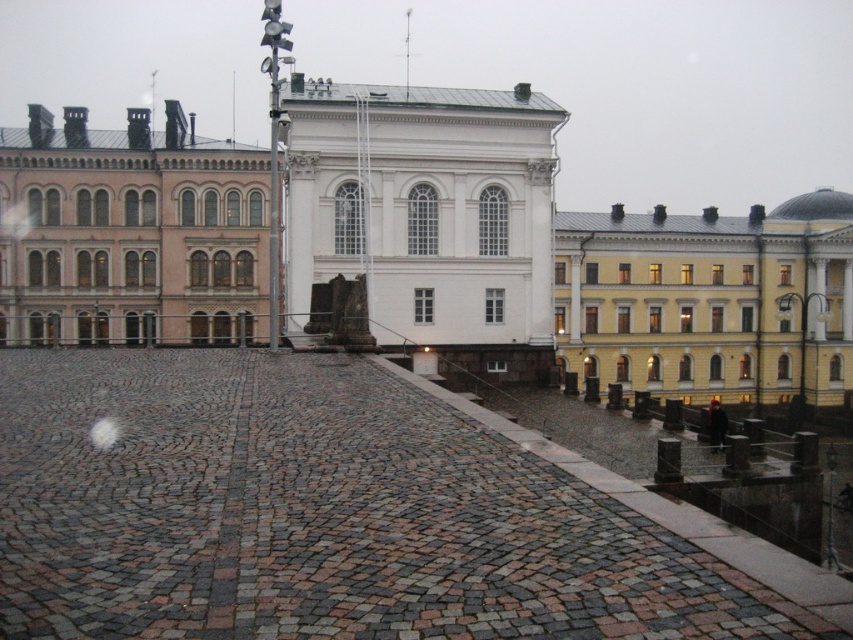
You are a tourist standing at the edge of the cobblestone plaza. You see the white smooth stone building at center and the yellow matte building at upper right. Which one is positioned higher in the image?

The white smooth stone building at center is positioned higher in the image than the yellow matte building at upper right.

You are a tourist standing in the plaza and want to take a photo of both the brown cobblestone courtyard at center and the pink stone building at left. Which object should you position closer to the left side of your camera frame to include both in the shot?

The pink stone building at left is on the left side of the brown cobblestone courtyard at center, so to include both in your photo, position the pink stone building at left closer to the left side of your camera frame.